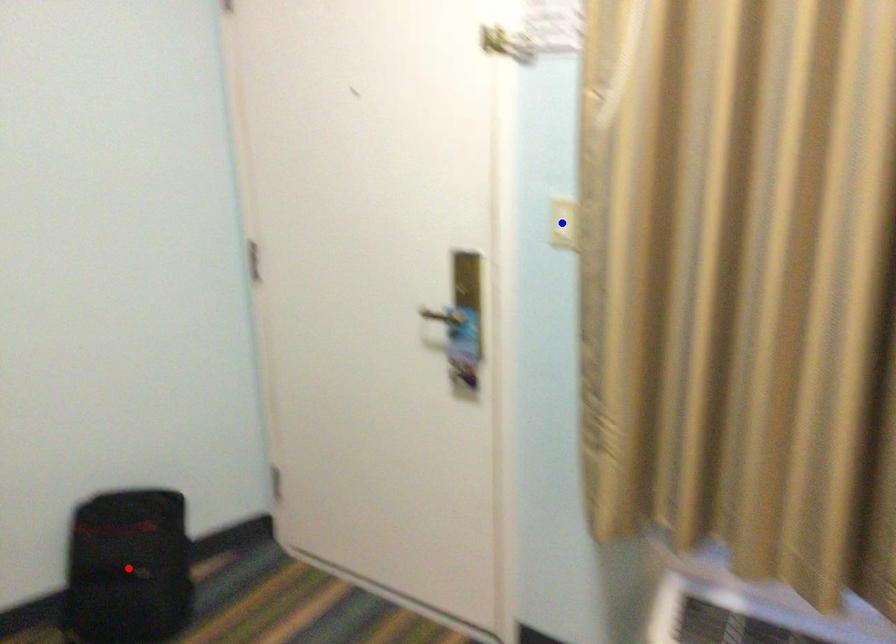
Question: Two points are marked on the image. Which point is closer to the camera?

Choices:
 (A) Blue point is closer.
 (B) Red point is closer.

Answer: (A)